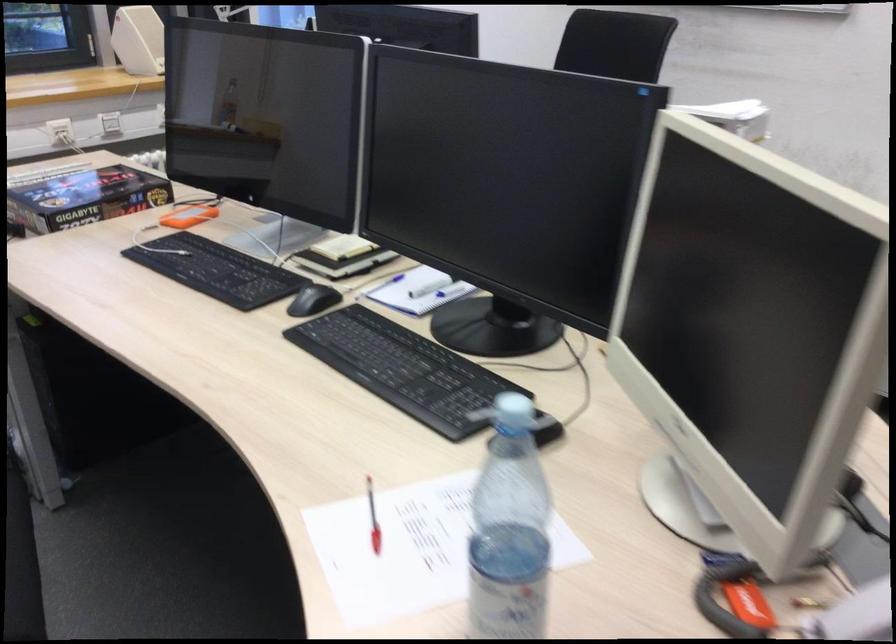
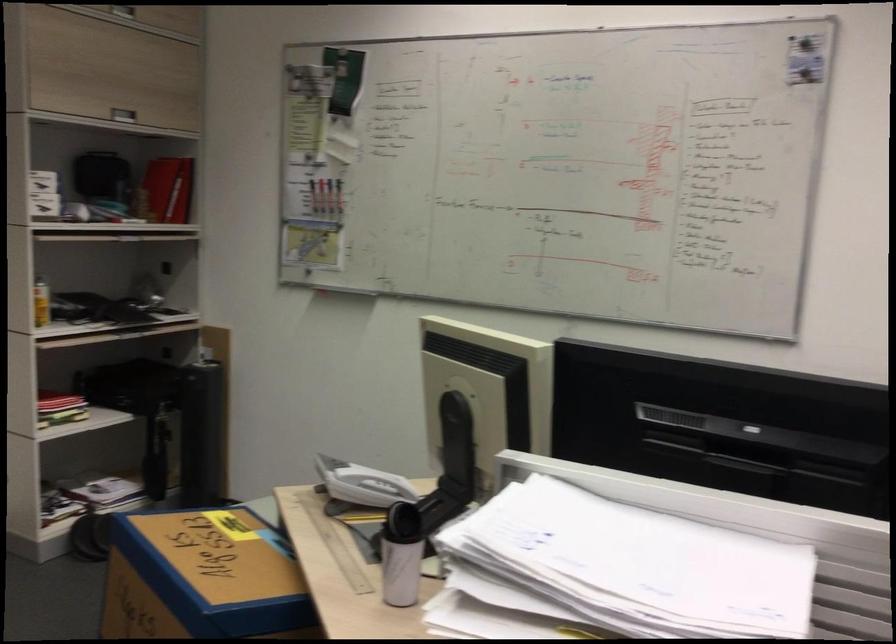
Question: I am providing you with two images of the same scene from different viewpoints. After the viewpoint changes to image2, which objects are now occluded?

Choices:
 (A) dark bag
 (B) phone handset
 (C) red and white pen
 (D) silver cabinet handle

Answer: (C)